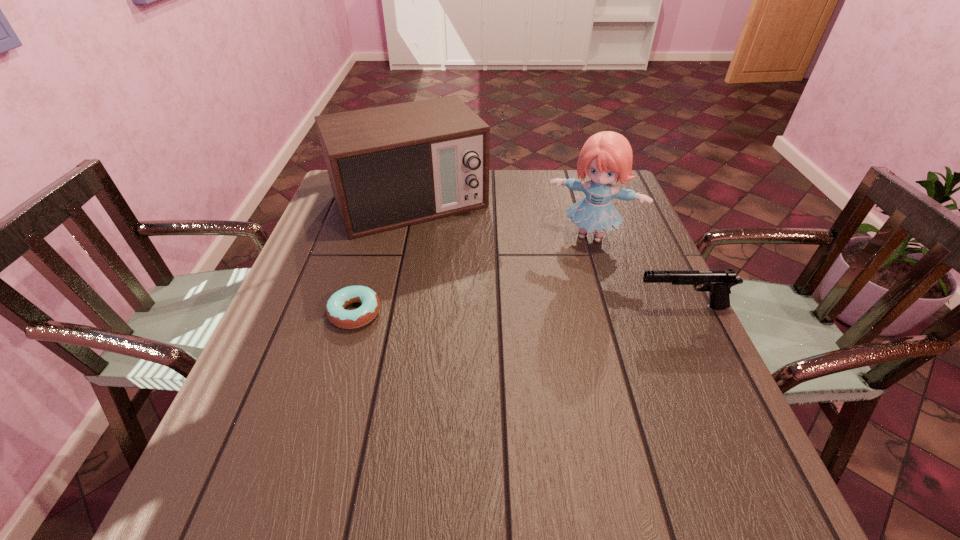
Where is `the shortest object`? The width and height of the screenshot is (960, 540). the shortest object is located at coordinates (347, 319).

Locate an element on the screen. The image size is (960, 540). the third tallest object is located at coordinates (717, 282).

Where is `doll`? doll is located at coordinates (606, 156).

Identify the location of the second tallest object. (392, 166).

Where is `blank space located on the front of the shortest object`? Image resolution: width=960 pixels, height=540 pixels. blank space located on the front of the shortest object is located at coordinates (342, 359).

Locate an element on the screen. This screenshot has height=540, width=960. free spot located at the aiming end of the third tallest object is located at coordinates [518, 307].

This screenshot has height=540, width=960. Identify the location of free space located 0.120m at the aiming end of the third tallest object. (584, 307).

Identify the location of free space located at the aiming end of the third tallest object. The height and width of the screenshot is (540, 960). (505, 307).

You are a GUI agent. You are given a task and a screenshot of the screen. Output one action in this format:
    pyautogui.click(x=<x>, y=<y>)
    Task: Click on the vacant space located 0.230m on the front-facing side of the tallest object
    The height and width of the screenshot is (540, 960).
    Given the screenshot: What is the action you would take?
    pyautogui.click(x=555, y=309)

Identify the location of free location located 0.370m on the front-facing side of the tallest object. The width and height of the screenshot is (960, 540). (538, 354).